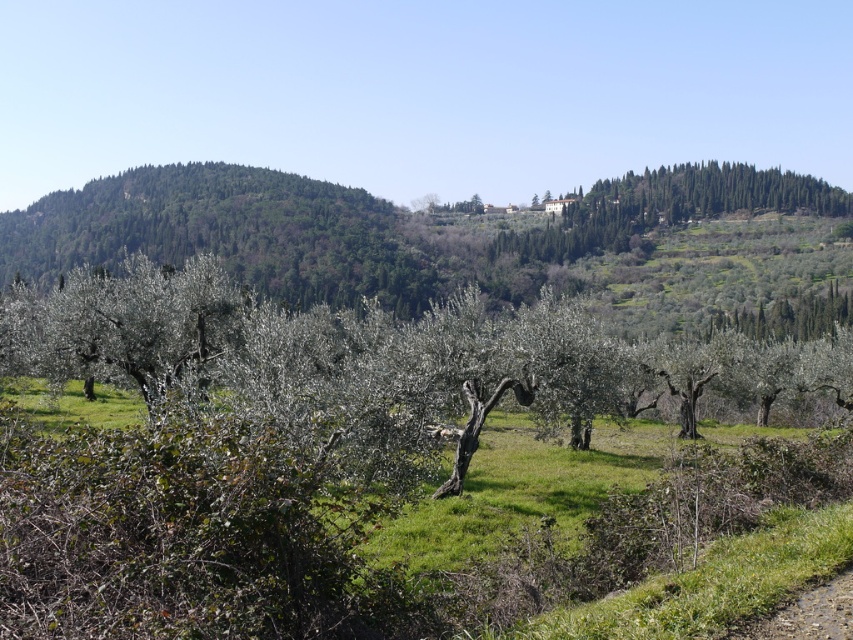
Can you confirm if green leafy tree at center is wider than green leafy trees at upper right?

No.

Can you confirm if green leafy tree at center is taller than green leafy trees at upper right?

No.

Who is more distant from viewer, [318,372] or [735,205]?

Positioned behind is point [735,205].

You are a GUI agent. You are given a task and a screenshot of the screen. Output one action in this format:
    pyautogui.click(x=<x>, y=<y>)
    Task: Click on the green leafy tree at center
    This screenshot has height=640, width=853.
    Given the screenshot: What is the action you would take?
    pyautogui.click(x=381, y=364)